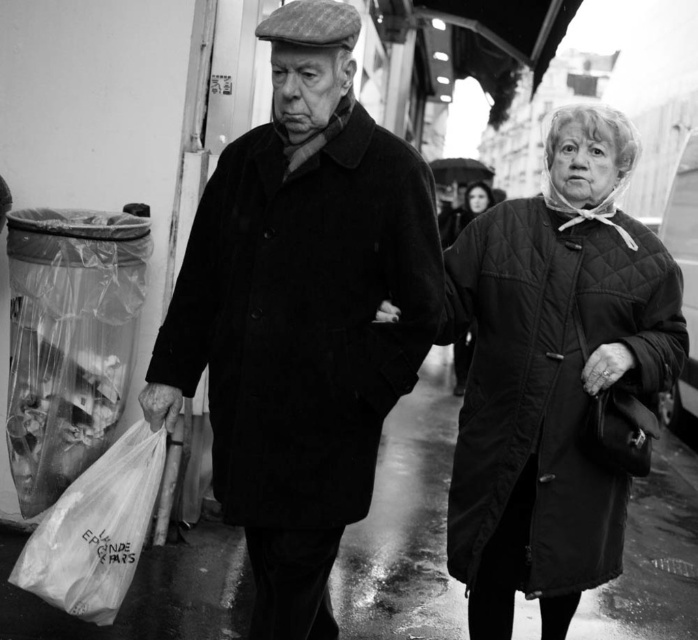
You are a photographer trying to capture a closeup of the matte black coat at center and the black matte umbrella at upper center in the scene. Which object should you focus on first to ensure it appears sharp in the photo?

You should focus on the matte black coat at center first since it is closer to the viewer than the black matte umbrella at upper center, ensuring it will be in focus before adjusting for the umbrella.

You are a photographer analyzing this black and white photo. You need to place a red dot exactly at the center of the matte black coat at center. What coordinates should you use?

You should place the red dot at the coordinates point (302, 314) since that is the 2D location of the matte black coat at center.